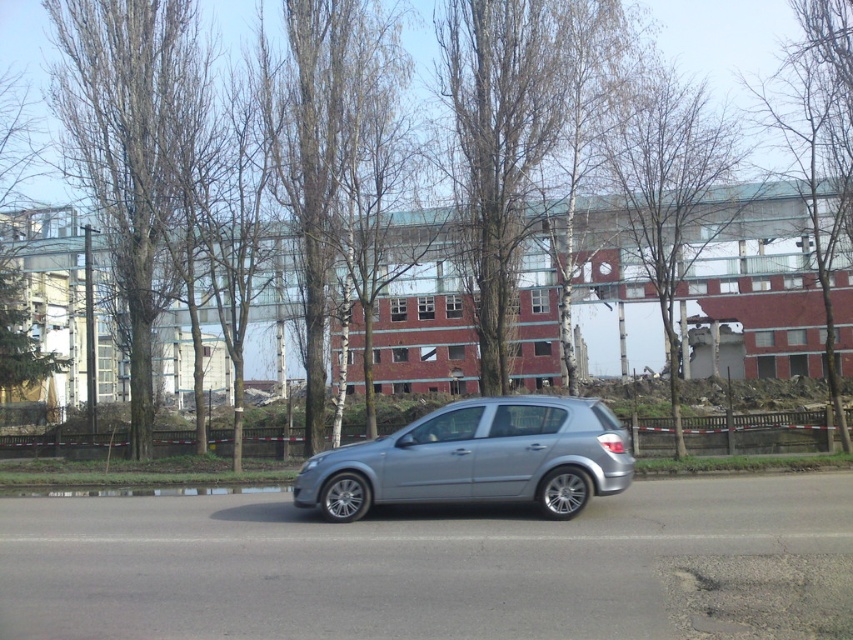
You are standing at the origin point of the image coordinate system. You want to walk to the bare wood tree at left. In which direction should you move?

Since the bare wood tree at left is located at point (132, 639) in the image coordinate system, you should move towards the left and slightly downward from your current position at the origin to reach it.

You are a pedestrian standing on the sidewalk and see the bare wood tree at left and the brown bark tree at center. Which tree is closer to you?

The bare wood tree at left is closer to you as it is positioned in front of the brown bark tree at center.

You are a city planner reviewing this urban scene. You need to determine which tree has a wider trunk between the brown bark tree at center and the bare wood tree at upper right. Which one is wider?

The brown bark tree at center has a wider trunk than the bare wood tree at upper right.